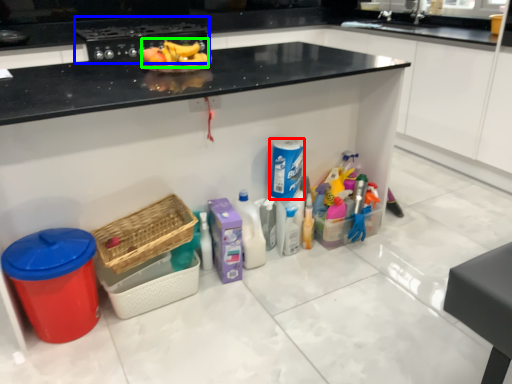
Question: Based on their relative distances, which object is nearer to cleaning product (highlighted by a red box)? Choose from appliance (highlighted by a blue box) and fruit (highlighted by a green box).

Choices:
 (A) appliance
 (B) fruit

Answer: (B)